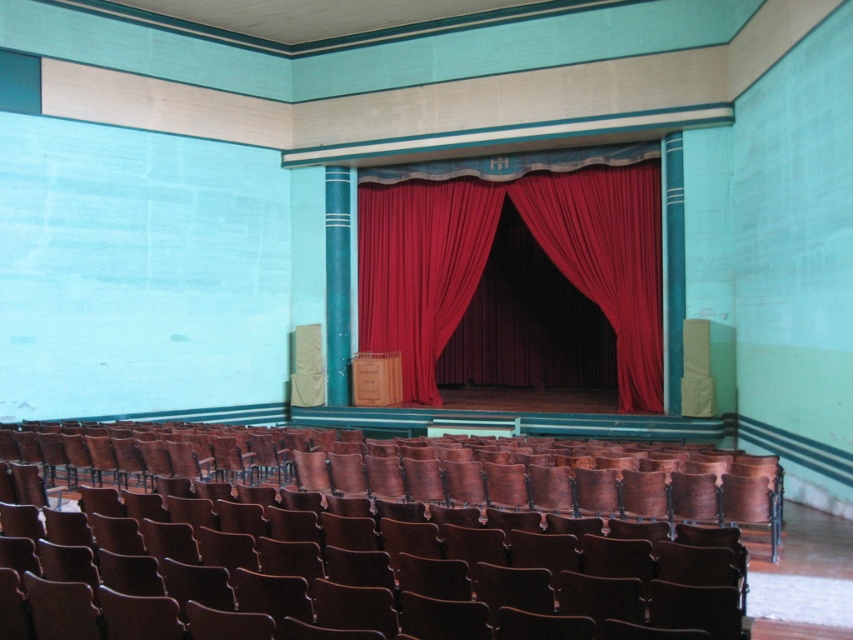
Question: Does wooden polished chair at lower center appear under red velvet curtain at center?

Choices:
 (A) yes
 (B) no

Answer: (A)

Question: Which of the following is the closest to the observer?

Choices:
 (A) click(x=305, y=582)
 (B) click(x=369, y=346)

Answer: (A)

Question: Considering the relative positions of wooden polished chair at lower center and red velvet curtain at center in the image provided, where is wooden polished chair at lower center located with respect to red velvet curtain at center?

Choices:
 (A) right
 (B) left

Answer: (A)

Question: Does wooden polished chair at lower center lie in front of red velvet curtain at center?

Choices:
 (A) yes
 (B) no

Answer: (A)

Question: Which object is farther from the camera taking this photo?

Choices:
 (A) wooden polished chair at lower center
 (B) red velvet curtain at center

Answer: (B)